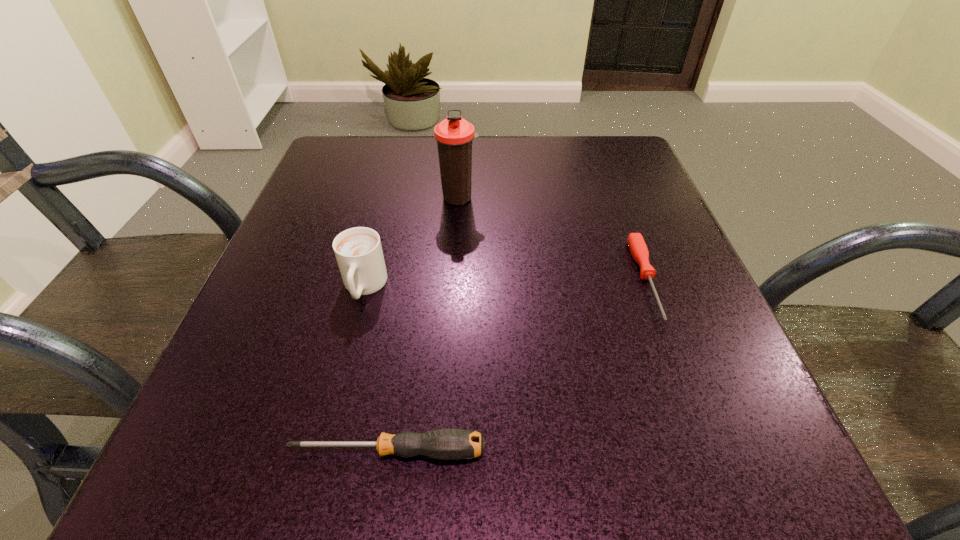
I want to click on thermos bottle, so click(x=454, y=135).

Where is `the tallest object`? the tallest object is located at coordinates (454, 135).

Locate an element on the screen. The image size is (960, 540). cappuccino is located at coordinates (358, 250).

Where is `the taller screwdriver`? This screenshot has width=960, height=540. the taller screwdriver is located at coordinates (444, 444).

The width and height of the screenshot is (960, 540). In order to click on the nearest object in this screenshot , I will do `click(444, 444)`.

Where is `the right screwdriver`? This screenshot has height=540, width=960. the right screwdriver is located at coordinates (636, 243).

Where is `the shortest object`? The width and height of the screenshot is (960, 540). the shortest object is located at coordinates (636, 243).

Locate an element on the screen. This screenshot has width=960, height=540. vacant space situated 0.300m on the right of the tallest object is located at coordinates (623, 198).

Locate an element on the screen. vacant region located on the side with the handle of the cappuccino is located at coordinates (323, 447).

Identify the location of vacant space located 0.130m on the right of the taller screwdriver. Image resolution: width=960 pixels, height=540 pixels. (590, 451).